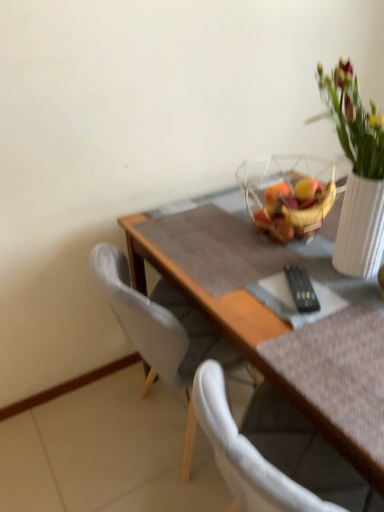
Where is `blank space situated above white fabric chair at left (from a real-world perspective)`? Image resolution: width=384 pixels, height=512 pixels. blank space situated above white fabric chair at left (from a real-world perspective) is located at coordinates (198, 243).